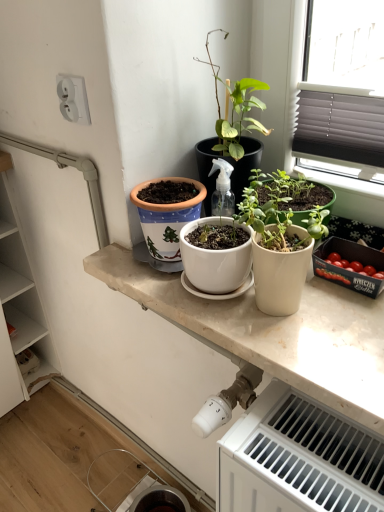
What are the coordinates of `free point in front of white matte pot at center` in the screenshot? It's located at (312, 351).